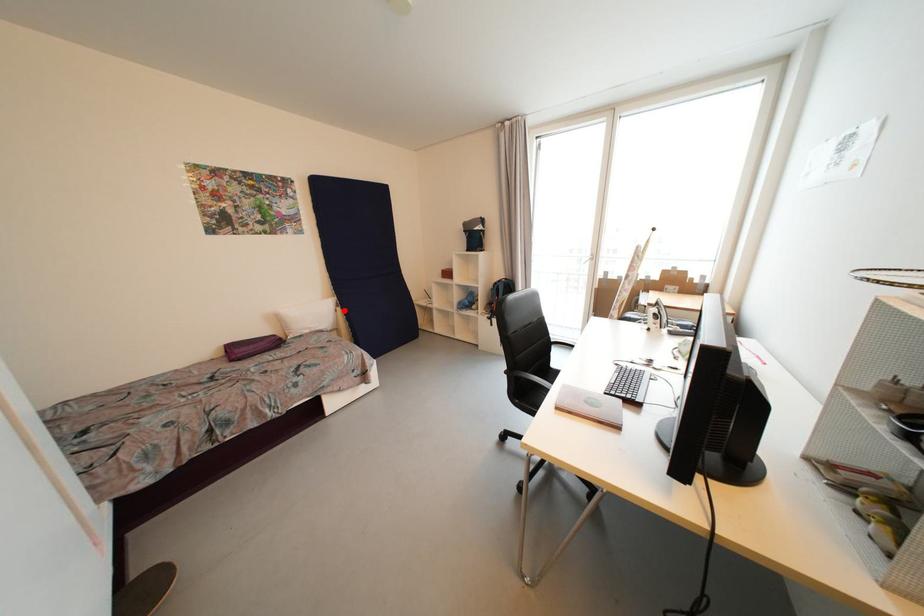
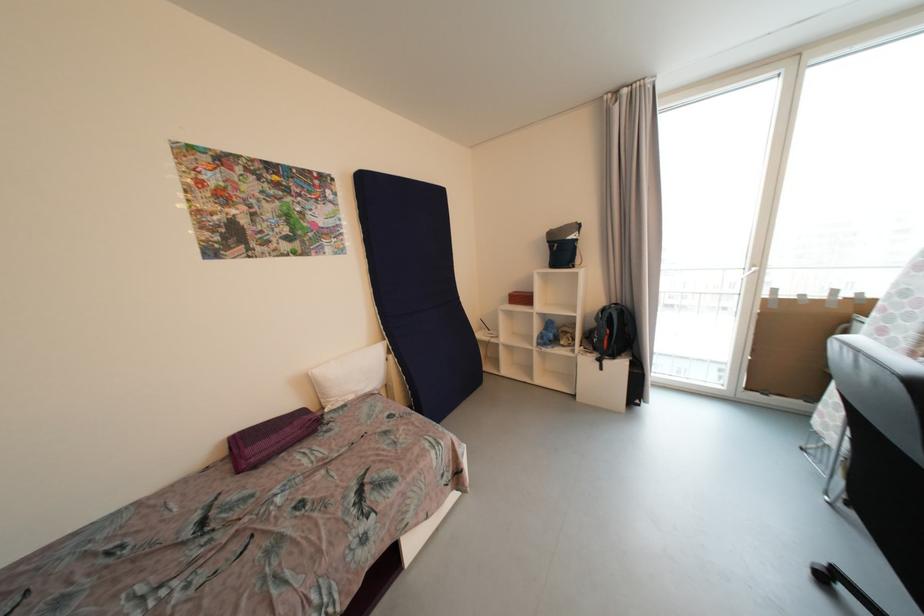
Question: I am providing you with two images of the same scene from different viewpoints. In image1, a red point is highlighted. Considering the same 3D point in image2, which of the following is correct?

Choices:
 (A) It is closer
 (B) It is farther

Answer: (A)